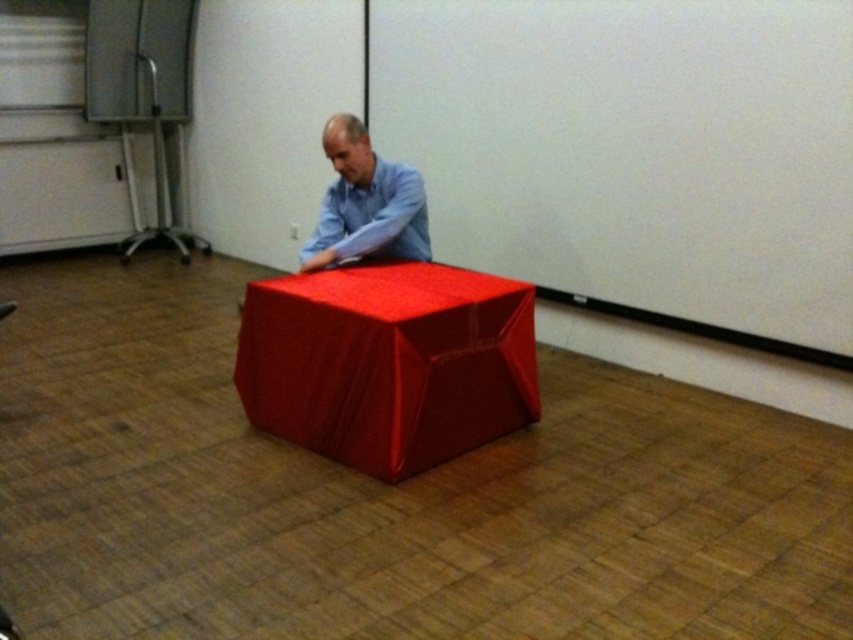
Who is more forward, (349,392) or (352,161)?

Point (349,392) is more forward.

Between shiny red cube at center and matte blue shirt at center, which one has more height?

Standing taller between the two is shiny red cube at center.

Which is behind, point (410, 301) or point (422, 200)?

The point (422, 200) is behind.

At what (x,y) coordinates should I click in order to perform the action: click on shiny red cube at center. Please return your answer as a coordinate pair (x, y). The width and height of the screenshot is (853, 640). Looking at the image, I should click on (387, 362).